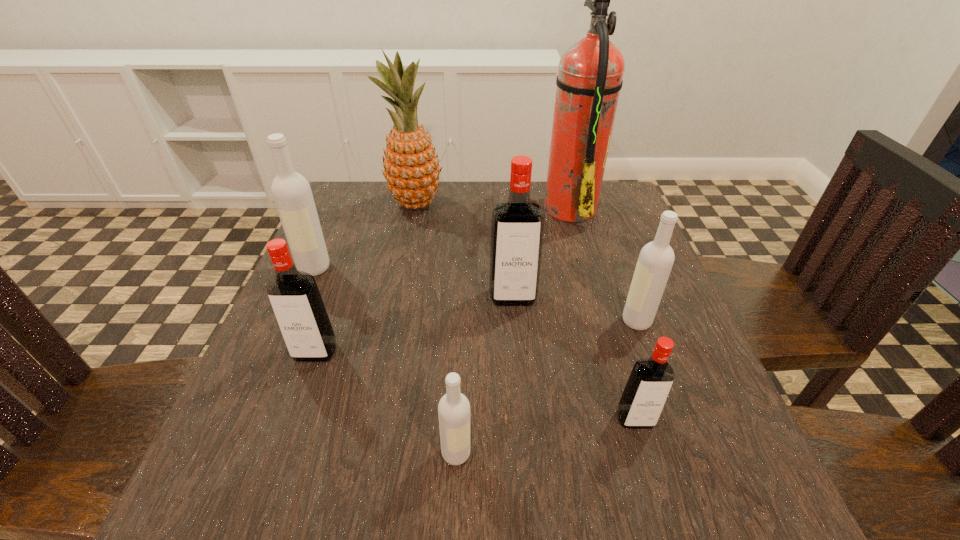
Identify the location of blank space located on the front and back of the second red vodka from right to left. (517, 348).

Locate an element on the screen. vacant space located 0.100m on the front of the second smallest white vodka is located at coordinates (657, 376).

Identify the location of vacant point located on the front and back of the second smallest red vodka. The height and width of the screenshot is (540, 960). (267, 487).

Locate an element on the screen. Image resolution: width=960 pixels, height=540 pixels. blank area located 0.080m on the front and back of the fifth farthest vodka is located at coordinates pos(654,484).

Locate an element on the screen. free space located on the back of the nearest vodka is located at coordinates (462, 318).

The height and width of the screenshot is (540, 960). In order to click on fire extinguisher that is at the far edge in this screenshot , I will do `click(589, 80)`.

Find the location of a particular element. pineapple that is at the far edge is located at coordinates (411, 167).

This screenshot has width=960, height=540. In order to click on object at the near edge in this screenshot , I will do `click(454, 408)`.

Identify the location of pineapple that is at the left edge. (411, 167).

This screenshot has width=960, height=540. I want to click on fire extinguisher that is at the right edge, so click(589, 80).